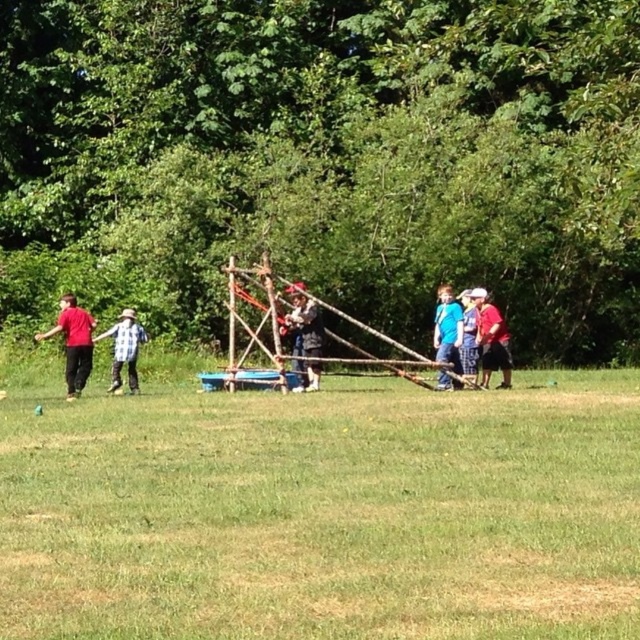
Question: From the image, what is the correct spatial relationship of matte red shirt at center in relation to wooden stick at center?

Choices:
 (A) right
 (B) left

Answer: (A)

Question: Which object appears closest to the camera in this image?

Choices:
 (A) plaid shirt at left
 (B) green grass at center

Answer: (B)

Question: Does green grass at center have a lesser width compared to matte red shirt at left?

Choices:
 (A) yes
 (B) no

Answer: (B)

Question: Among these points, which one is farthest from the camera?

Choices:
 (A) (129, 372)
 (B) (435, 326)

Answer: (B)

Question: Which is nearer to the matte red shirt at left?

Choices:
 (A) blue plaid shorts at center
 (B) green grass at center
 (C) wooden stick at center
 (D) blue matte shirt at center

Answer: (C)

Question: Does matte red shirt at left have a larger size compared to blue plaid shorts at center?

Choices:
 (A) no
 (B) yes

Answer: (A)